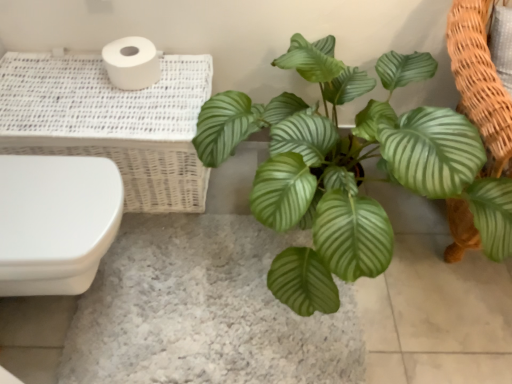
At what (x,y) coordinates should I click in order to perform the action: click on free space above green leafy plant at center (from a real-world perspective). Please return your answer as a coordinate pair (x, y). This screenshot has height=384, width=512. Looking at the image, I should click on (205, 289).